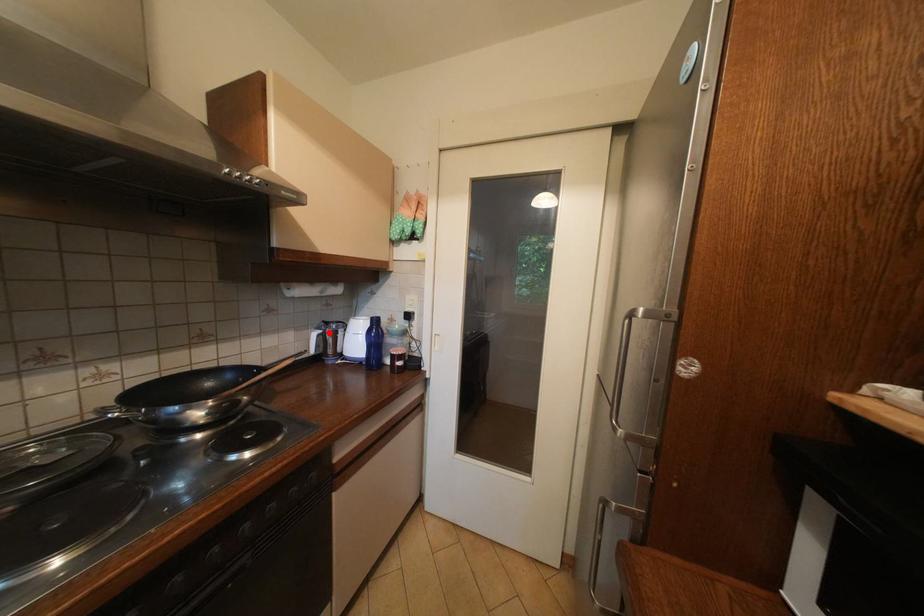
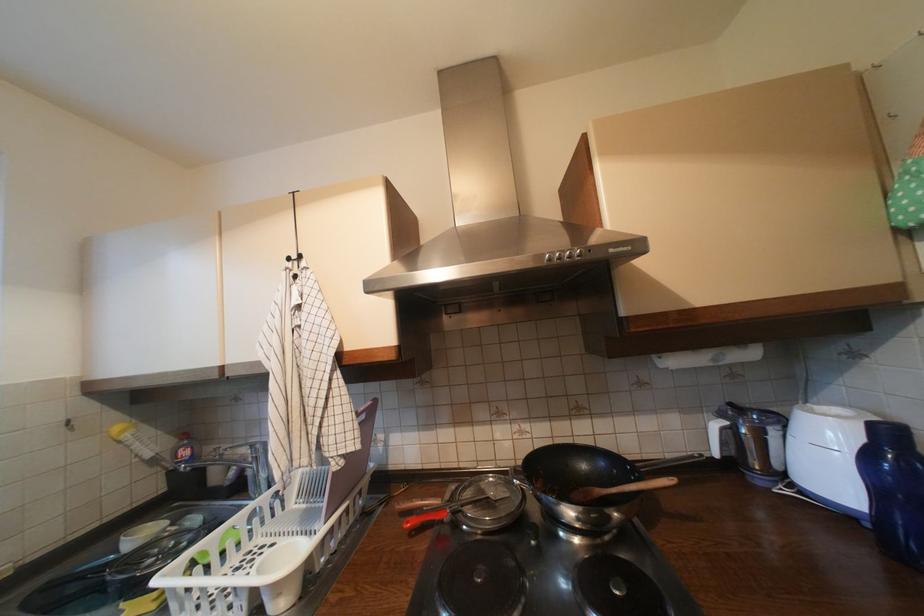
Question: I am providing you with two images of the same scene from different viewpoints. A red point is marked on the first image. Can you still see the location of the red point in image 2?

Choices:
 (A) Yes
 (B) No

Answer: (A)